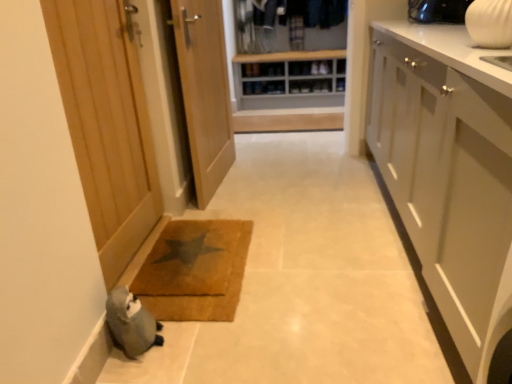
Question: Looking at the image, does braided brown mat at lower center seem bigger or smaller compared to wooden door at center, marked as the second door in a left-to-right arrangement?

Choices:
 (A) small
 (B) big

Answer: (A)

Question: From the image's perspective, is braided brown mat at lower center located above or below wooden door at center, which is counted as the first door, starting from the right?

Choices:
 (A) below
 (B) above

Answer: (A)

Question: Which object is the farthest from the gray knitted stuffed animal at lower left?

Choices:
 (A) braided brown mat at lower center
 (B) wooden door at left, which appears as the first door when viewed from the left
 (C) wooden shoe rack at center
 (D) white matte cabinet at right
 (E) wooden door at center, marked as the second door in a left-to-right arrangement

Answer: (C)

Question: Considering the real-world distances, which object is closest to the wooden door at left, the second door from the right?

Choices:
 (A) wooden door at center, marked as the second door in a left-to-right arrangement
 (B) wooden shoe rack at center
 (C) braided brown mat at lower center
 (D) white matte cabinet at right
 (E) gray knitted stuffed animal at lower left

Answer: (C)